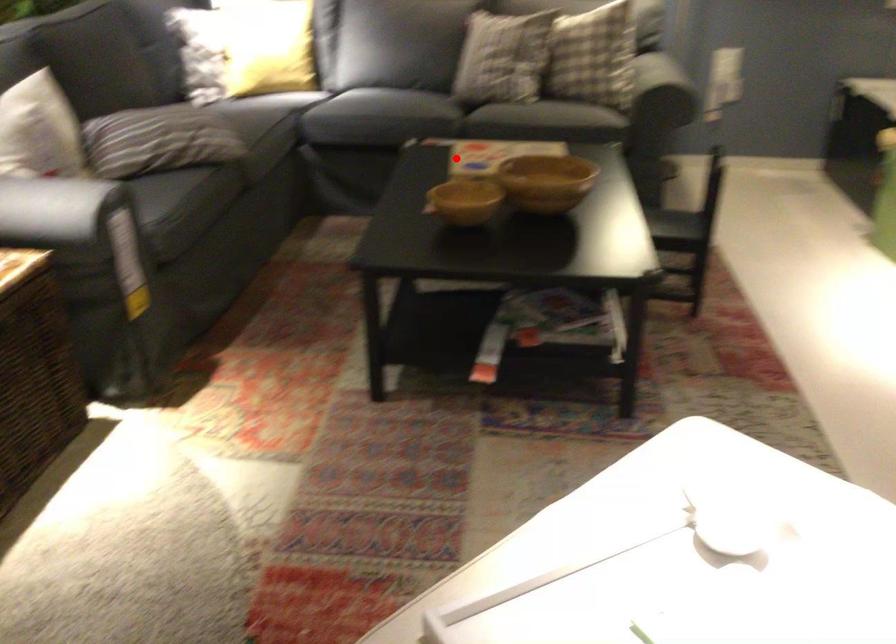
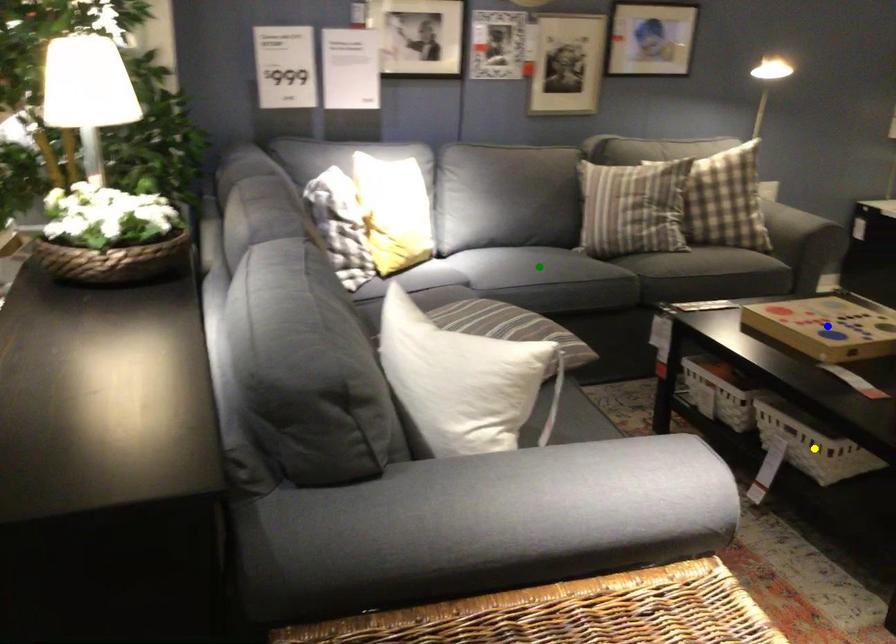
Question: I am providing you with two images of the same scene from different viewpoints. A red point is marked on the first image. You are given multiple points on the second image. Which spot in image 2 lines up with the point in image 1?

Choices:
 (A) blue point
 (B) green point
 (C) yellow point

Answer: (A)